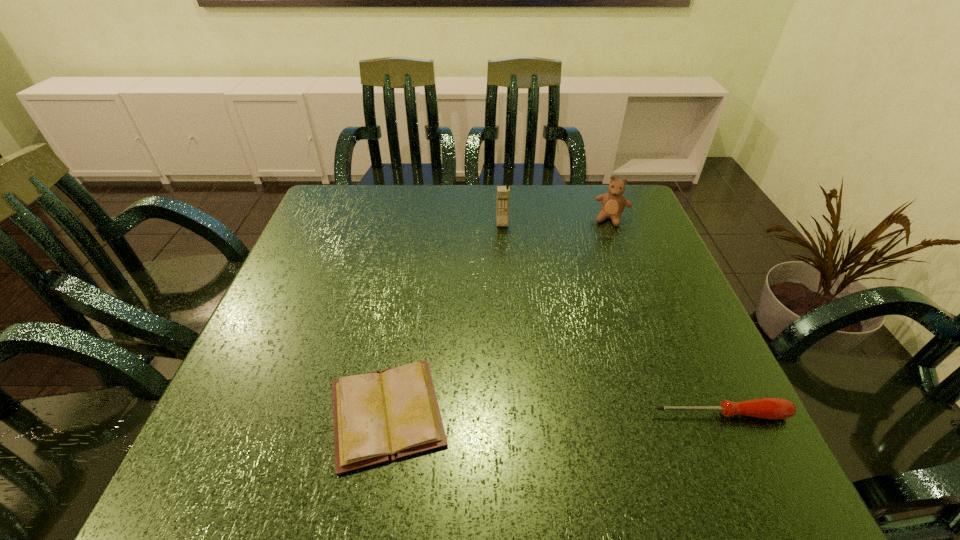
You are a GUI agent. You are given a task and a screenshot of the screen. Output one action in this format:
    pyautogui.click(x=<x>, y=<y>)
    Task: Click on the object that is at the near right corner
    
    Given the screenshot: What is the action you would take?
    pyautogui.click(x=772, y=408)

Find the location of a particular element. The width and height of the screenshot is (960, 540). vacant region at the far edge of the desktop is located at coordinates (558, 191).

Where is `free space at the left edge of the desktop`? This screenshot has width=960, height=540. free space at the left edge of the desktop is located at coordinates (330, 276).

You are a GUI agent. You are given a task and a screenshot of the screen. Output one action in this format:
    pyautogui.click(x=<x>, y=<y>)
    Task: Click on the free point at the right edge
    The width and height of the screenshot is (960, 540).
    Given the screenshot: What is the action you would take?
    pyautogui.click(x=665, y=377)

Find the location of a particular element. free space at the far right corner of the desktop is located at coordinates (582, 193).

The height and width of the screenshot is (540, 960). I want to click on free space that is in between the third shortest object and the shortest object, so click(499, 316).

This screenshot has height=540, width=960. I want to click on free space between the cellular telephone and the leftmost object, so click(444, 318).

Locate an element on the screen. The width and height of the screenshot is (960, 540). free space between the third tallest object and the teddy bear is located at coordinates (666, 316).

Find the location of a particular element. free space between the tallest object and the leftmost object is located at coordinates (444, 318).

Identify the location of unoccupied position between the tallest object and the screwdriver. (612, 319).